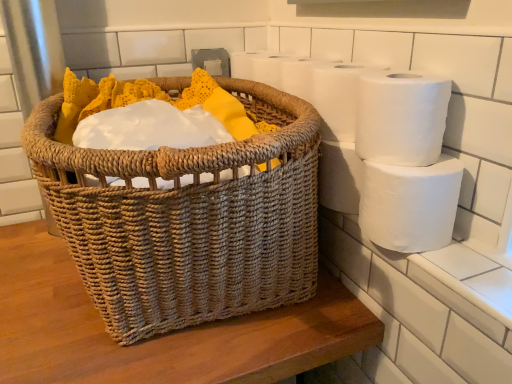
How much space does white matte toilet paper at right, which is the 3th toilet paper from top to bottom, occupy vertically?

white matte toilet paper at right, which is the 3th toilet paper from top to bottom, is 5.48 inches tall.

Describe the element at coordinates (410, 204) in the screenshot. I see `white matte toilet paper at right, which is the 3th toilet paper from top to bottom` at that location.

What do you see at coordinates (401, 118) in the screenshot?
I see `white matte toilet paper at upper right, which appears as the 2th toilet paper when ordered from the bottom` at bounding box center [401, 118].

The height and width of the screenshot is (384, 512). What are the coordinates of `woven natural basket at center` in the screenshot? It's located at (188, 219).

Could you tell me if white matte toilet paper at right, which is counted as the 1th toilet paper, starting from the bottom, is facing white matte toilet paper at upper right, the 2th toilet paper positioned from the top?

No, white matte toilet paper at right, which is counted as the 1th toilet paper, starting from the bottom, is not turned towards white matte toilet paper at upper right, the 2th toilet paper positioned from the top.

Does white matte toilet paper at right, which is counted as the 1th toilet paper, starting from the bottom, have a greater height compared to white matte toilet paper at upper right, the 2th toilet paper positioned from the top?

Yes.

Which is closer to the camera, (436, 180) or (437, 126)?

The point (436, 180) is closer.

Is point (362, 76) closer or farther from the camera than point (323, 103)?

Point (362, 76) is closer to the camera than point (323, 103).

What's the angular difference between white matte toilet paper at upper right, which appears as the 2th toilet paper when ordered from the bottom, and white matte toilet paper at upper right, the third toilet paper ordered from the bottom,'s facing directions?

The angular difference between white matte toilet paper at upper right, which appears as the 2th toilet paper when ordered from the bottom, and white matte toilet paper at upper right, the third toilet paper ordered from the bottom, is 1.25 degrees.

From a real-world perspective, is white matte toilet paper at upper right, the 2th toilet paper positioned from the top, on top of white matte toilet paper at upper right, the third toilet paper ordered from the bottom?

Yes, from a real-world perspective, white matte toilet paper at upper right, the 2th toilet paper positioned from the top, is above white matte toilet paper at upper right, the third toilet paper ordered from the bottom.

Are white matte toilet paper at upper right, the 2th toilet paper positioned from the top, and white matte toilet paper at upper right, the third toilet paper ordered from the bottom, making contact?

No, white matte toilet paper at upper right, the 2th toilet paper positioned from the top, is not in contact with white matte toilet paper at upper right, the third toilet paper ordered from the bottom.

Between woven natural basket at center and white matte toilet paper at upper right, the third toilet paper ordered from the bottom, which one has less height?

white matte toilet paper at upper right, the third toilet paper ordered from the bottom, is shorter.

Considering the positions of point (244, 145) and point (318, 91), is point (244, 145) closer or farther from the camera than point (318, 91)?

Point (244, 145).

In the scene shown: Is woven natural basket at center behind white matte toilet paper at upper right, the third toilet paper ordered from the bottom?

No, woven natural basket at center is closer to the camera.

Considering the sizes of objects woven natural basket at center and white matte toilet paper at upper right, the third toilet paper ordered from the bottom, in the image provided, who is smaller, woven natural basket at center or white matte toilet paper at upper right, the third toilet paper ordered from the bottom,?

white matte toilet paper at upper right, the third toilet paper ordered from the bottom, is smaller.

Can we say white matte toilet paper at upper right, which appears as the 2th toilet paper when ordered from the bottom, lies outside woven natural basket at center?

Yes, white matte toilet paper at upper right, which appears as the 2th toilet paper when ordered from the bottom, is outside of woven natural basket at center.

Is white matte toilet paper at upper right, the 2th toilet paper positioned from the top, with woven natural basket at center?

white matte toilet paper at upper right, the 2th toilet paper positioned from the top, and woven natural basket at center are not in contact.

Relative to woven natural basket at center, is white matte toilet paper at upper right, which appears as the 2th toilet paper when ordered from the bottom, in front or behind?

In the image, white matte toilet paper at upper right, which appears as the 2th toilet paper when ordered from the bottom, appears behind woven natural basket at center.

Which is more to the right, white matte toilet paper at upper right, the 2th toilet paper positioned from the top, or woven natural basket at center?

white matte toilet paper at upper right, the 2th toilet paper positioned from the top.

Is white matte toilet paper at right, which is counted as the 1th toilet paper, starting from the bottom, aimed at woven natural basket at center?

Yes.

What's the angular difference between white matte toilet paper at right, which is counted as the 1th toilet paper, starting from the bottom, and woven natural basket at center's facing directions?

The facing directions of white matte toilet paper at right, which is counted as the 1th toilet paper, starting from the bottom, and woven natural basket at center are 0.00154 degrees apart.

Does white matte toilet paper at right, which is counted as the 1th toilet paper, starting from the bottom, have a lesser height compared to woven natural basket at center?

Correct, white matte toilet paper at right, which is counted as the 1th toilet paper, starting from the bottom, is not as tall as woven natural basket at center.

Between white matte toilet paper at right, which is the 3th toilet paper from top to bottom, and woven natural basket at center, which one appears on the right side from the viewer's perspective?

Positioned to the right is white matte toilet paper at right, which is the 3th toilet paper from top to bottom.

Can you confirm if woven natural basket at center is smaller than white matte toilet paper at right, which is counted as the 1th toilet paper, starting from the bottom?

No, woven natural basket at center is not smaller than white matte toilet paper at right, which is counted as the 1th toilet paper, starting from the bottom.

From a real-world perspective, who is located lower, woven natural basket at center or white matte toilet paper at right, which is the 3th toilet paper from top to bottom?

In real-world perspective, white matte toilet paper at right, which is the 3th toilet paper from top to bottom, is lower.

Is woven natural basket at center facing away from white matte toilet paper at right, which is the 3th toilet paper from top to bottom?

Correct, woven natural basket at center is looking away from white matte toilet paper at right, which is the 3th toilet paper from top to bottom.

Is woven natural basket at center not near white matte toilet paper at right, which is the 3th toilet paper from top to bottom?

No, woven natural basket at center is not far away from white matte toilet paper at right, which is the 3th toilet paper from top to bottom.

Is white matte toilet paper at upper right, the third toilet paper ordered from the bottom, not within woven natural basket at center?

white matte toilet paper at upper right, the third toilet paper ordered from the bottom, is positioned outside woven natural basket at center.

Is white matte toilet paper at upper right, the first toilet paper in the top-to-bottom sequence, with woven natural basket at center?

No, white matte toilet paper at upper right, the first toilet paper in the top-to-bottom sequence, is not making contact with woven natural basket at center.

Is white matte toilet paper at upper right, the third toilet paper ordered from the bottom, aimed at woven natural basket at center?

Yes, white matte toilet paper at upper right, the third toilet paper ordered from the bottom, is facing woven natural basket at center.

Between white matte toilet paper at upper right, the third toilet paper ordered from the bottom, and woven natural basket at center, which one has larger size?

With larger size is woven natural basket at center.

You are a GUI agent. You are given a task and a screenshot of the screen. Output one action in this format:
    pyautogui.click(x=<x>, y=<y>)
    Task: Click on the toilet paper lying in front of the white matte toilet paper at right, which is the 3th toilet paper from top to bottom
    
    Given the screenshot: What is the action you would take?
    pyautogui.click(x=401, y=118)

The width and height of the screenshot is (512, 384). Find the location of `toilet paper located above the white matte toilet paper at upper right, the first toilet paper in the top-to-bottom sequence (from a real-world perspective)`. toilet paper located above the white matte toilet paper at upper right, the first toilet paper in the top-to-bottom sequence (from a real-world perspective) is located at coordinates (401, 118).

Considering their positions, is white matte toilet paper at upper right, which appears as the 2th toilet paper when ordered from the bottom, positioned further to woven natural basket at center than white matte toilet paper at upper right, the third toilet paper ordered from the bottom?

white matte toilet paper at upper right, which appears as the 2th toilet paper when ordered from the bottom, is positioned further to the anchor woven natural basket at center.

Estimate the real-world distances between objects in this image. Which object is further from woven natural basket at center, white matte toilet paper at right, which is counted as the 1th toilet paper, starting from the bottom, or white matte toilet paper at upper right, which appears as the 2th toilet paper when ordered from the bottom?

white matte toilet paper at upper right, which appears as the 2th toilet paper when ordered from the bottom, lies further to woven natural basket at center than the other object.

From the image, which object appears to be farther from white matte toilet paper at upper right, which appears as the 2th toilet paper when ordered from the bottom, white matte toilet paper at right, which is the 3th toilet paper from top to bottom, or woven natural basket at center?

Based on the image, woven natural basket at center appears to be further to white matte toilet paper at upper right, which appears as the 2th toilet paper when ordered from the bottom.

Which object lies further to the anchor point white matte toilet paper at upper right, the first toilet paper in the top-to-bottom sequence, white matte toilet paper at upper right, the 2th toilet paper positioned from the top, or white matte toilet paper at right, which is counted as the 1th toilet paper, starting from the bottom?

The object further to white matte toilet paper at upper right, the first toilet paper in the top-to-bottom sequence, is white matte toilet paper at right, which is counted as the 1th toilet paper, starting from the bottom.

From the picture: When comparing their distances from white matte toilet paper at upper right, the third toilet paper ordered from the bottom, does white matte toilet paper at right, which is counted as the 1th toilet paper, starting from the bottom, or woven natural basket at center seem further?

The object further to white matte toilet paper at upper right, the third toilet paper ordered from the bottom, is woven natural basket at center.

Based on their spatial positions, is woven natural basket at center or white matte toilet paper at right, which is the 3th toilet paper from top to bottom, further from white matte toilet paper at upper right, the 2th toilet paper positioned from the top?

woven natural basket at center is further to white matte toilet paper at upper right, the 2th toilet paper positioned from the top.

Which object lies further to the anchor point white matte toilet paper at right, which is counted as the 1th toilet paper, starting from the bottom, white matte toilet paper at upper right, which appears as the 2th toilet paper when ordered from the bottom, or white matte toilet paper at upper right, the third toilet paper ordered from the bottom?

white matte toilet paper at upper right, the third toilet paper ordered from the bottom, is further to white matte toilet paper at right, which is counted as the 1th toilet paper, starting from the bottom.

Looking at this image, estimate the real-world distances between objects in this image. Which object is further from white matte toilet paper at upper right, which appears as the 2th toilet paper when ordered from the bottom, woven natural basket at center or white matte toilet paper at upper right, the first toilet paper in the top-to-bottom sequence?

woven natural basket at center is positioned further to the anchor white matte toilet paper at upper right, which appears as the 2th toilet paper when ordered from the bottom.

Find the location of `toilet paper between white matte toilet paper at upper right, the third toilet paper ordered from the bottom, and white matte toilet paper at right, which is the 3th toilet paper from top to bottom, from top to bottom`. toilet paper between white matte toilet paper at upper right, the third toilet paper ordered from the bottom, and white matte toilet paper at right, which is the 3th toilet paper from top to bottom, from top to bottom is located at coordinates (401, 118).

In order to click on toilet paper between woven natural basket at center and white matte toilet paper at upper right, which appears as the 2th toilet paper when ordered from the bottom, from left to right in this screenshot , I will do `click(337, 98)`.